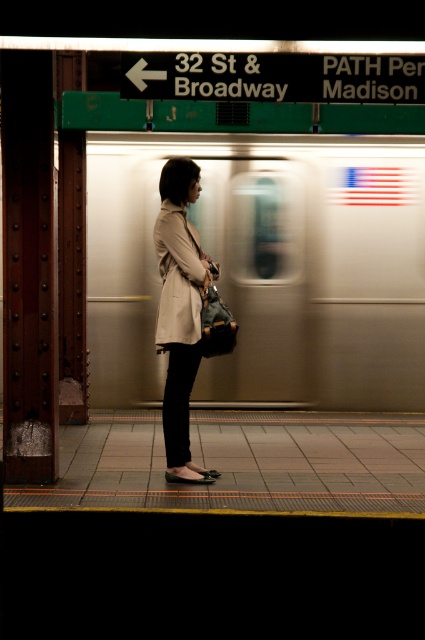
Question: Among these objects, which one is nearest to the camera?

Choices:
 (A) beige fabric trench coat at center
 (B) leather textured briefcase at center
 (C) silver metallic train at center

Answer: (B)

Question: Does silver metallic train at center come behind beige fabric trench coat at center?

Choices:
 (A) no
 (B) yes

Answer: (B)

Question: Among these objects, which one is farthest from the camera?

Choices:
 (A) metallic green sign at upper center
 (B) leather textured briefcase at center

Answer: (B)

Question: Does silver metallic train at center appear on the right side of beige fabric trench coat at center?

Choices:
 (A) yes
 (B) no

Answer: (A)

Question: Which point appears farthest from the camera in this image?

Choices:
 (A) 164,173
 (B) 164,202

Answer: (B)

Question: Does silver metallic train at center come in front of beige fabric coat at center?

Choices:
 (A) yes
 (B) no

Answer: (B)